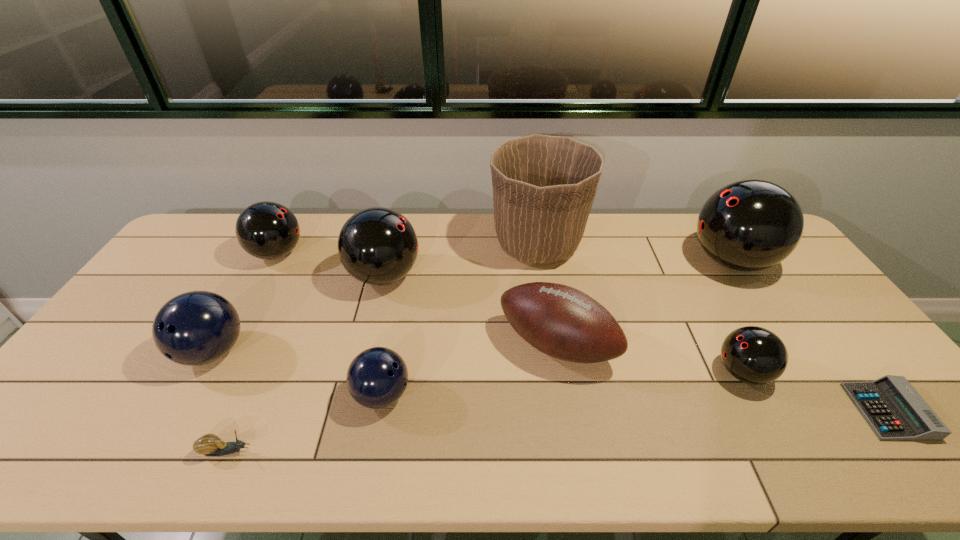
Locate an element on the screen. The height and width of the screenshot is (540, 960). vacant space at the near left corner of the desktop is located at coordinates (36, 451).

The width and height of the screenshot is (960, 540). Identify the location of free area in between the leftmost black bowling ball and the football (American). (417, 299).

The width and height of the screenshot is (960, 540). I want to click on free space between the left blue bowling ball and the ninth shortest object, so click(471, 306).

You are a GUI agent. You are given a task and a screenshot of the screen. Output one action in this format:
    pyautogui.click(x=<x>, y=<y>)
    Task: Click on the vacant space that's between the flowerpot and the fifth shortest bowling ball
    
    Given the screenshot: What is the action you would take?
    pyautogui.click(x=461, y=260)

Where is `free space between the nearest black bowling ball and the brown football (American)`? free space between the nearest black bowling ball and the brown football (American) is located at coordinates (650, 359).

Image resolution: width=960 pixels, height=540 pixels. I want to click on free space between the left blue bowling ball and the smaller blue bowling ball, so click(298, 373).

In order to click on free spot between the flowerpot and the second tallest object in this screenshot , I will do `click(635, 252)`.

This screenshot has width=960, height=540. Identify the location of free space between the bigger blue bowling ball and the flowerpot. (375, 298).

At what (x,y) coordinates should I click in order to perform the action: click on object that is the second closest to the smallest black bowling ball. Please return your answer as a coordinate pair (x, y). The width and height of the screenshot is (960, 540). Looking at the image, I should click on (749, 225).

What are the coordinates of `object that is the sixth closest to the left blue bowling ball` in the screenshot? It's located at (544, 186).